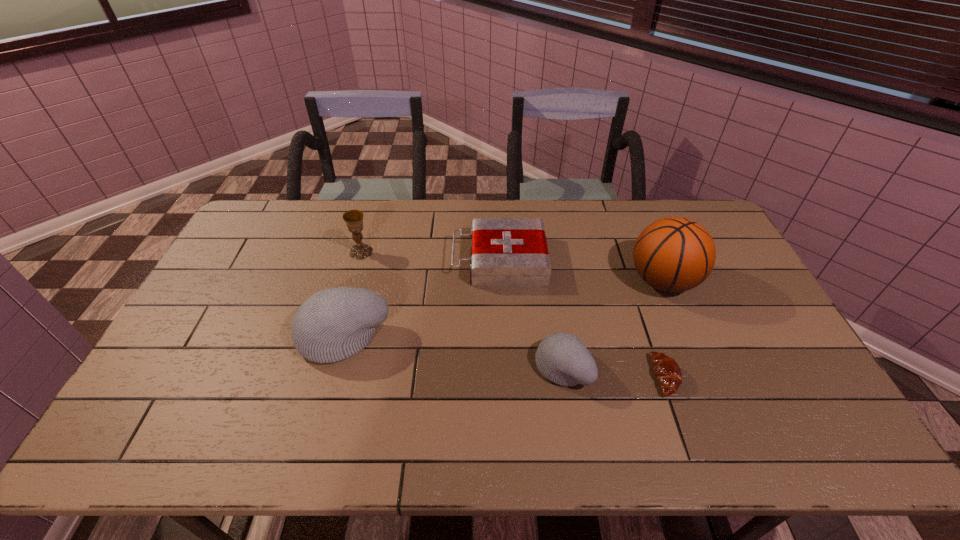
Image resolution: width=960 pixels, height=540 pixels. Identify the location of vacant place for an extra beanie on the right. (810, 403).